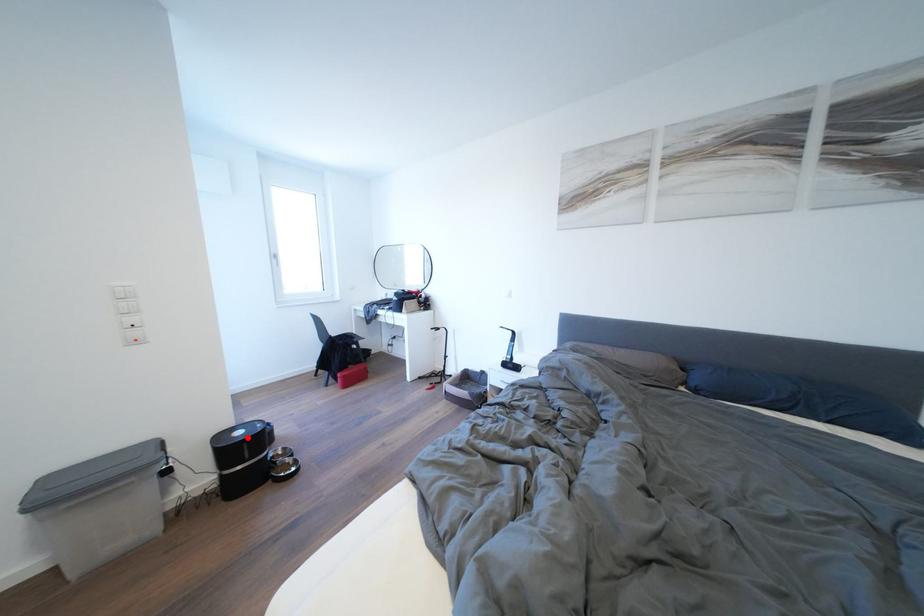
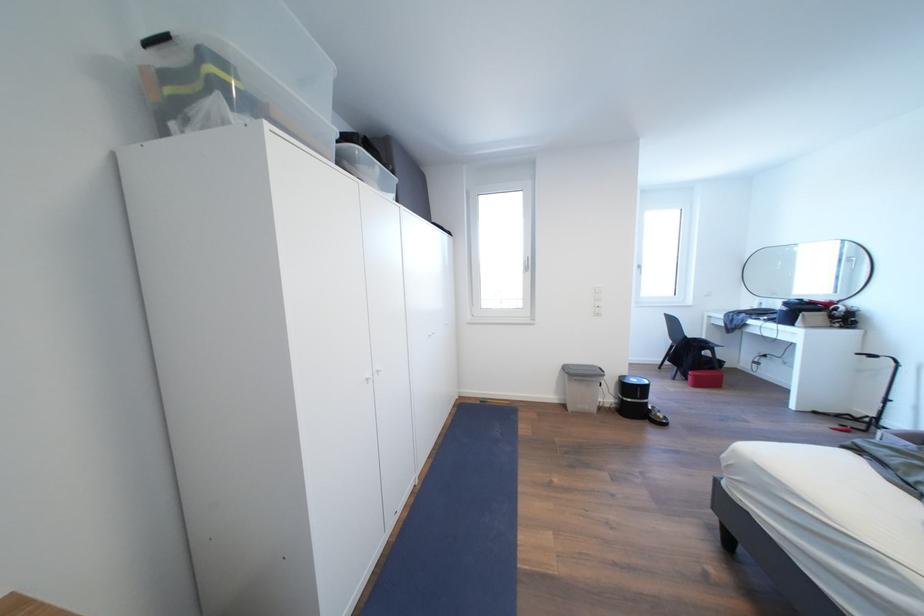
Question: A red point is marked in image1. In image2, is the corresponding 3D point closer to the camera or farther? Reply with the corresponding letter.

Choices:
 (A) The corresponding 3D point is closer.
 (B) The corresponding 3D point is farther.

Answer: (B)